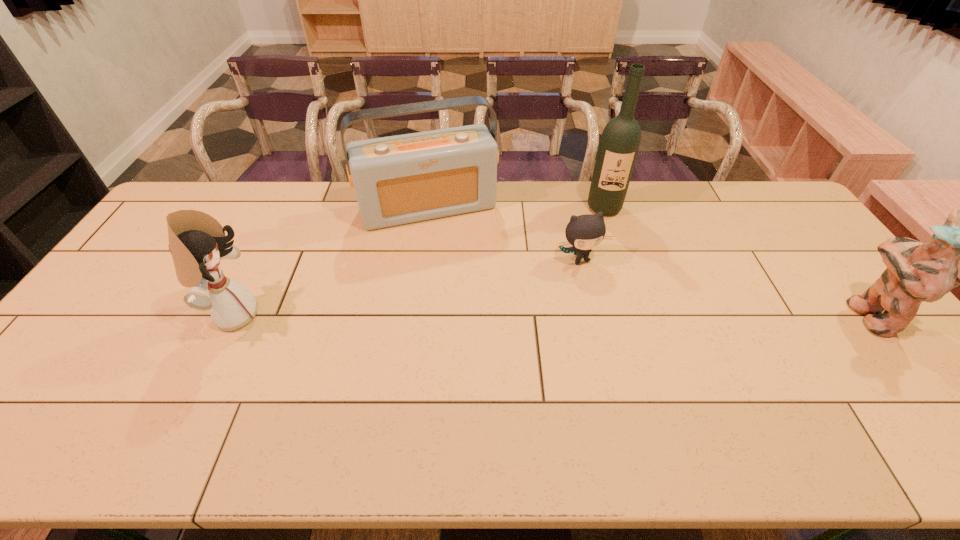
The height and width of the screenshot is (540, 960). What are the coordinates of `free space located on the front-facing side of the radio receiver` in the screenshot? It's located at (473, 305).

Identify the location of free space located on the front-facing side of the radio receiver. Image resolution: width=960 pixels, height=540 pixels. (453, 251).

This screenshot has height=540, width=960. What are the coordinates of `blank space located 0.050m on the front-facing side of the radio receiver` in the screenshot? It's located at (449, 241).

Identify the location of free space located on the labeled side of the tallest object. (608, 245).

Find the location of a particular element. vacant space located 0.300m on the labeled side of the tallest object is located at coordinates (612, 281).

Where is `free space located on the labeled side of the tallest object`? free space located on the labeled side of the tallest object is located at coordinates (610, 262).

Identify the location of vacant space situated 0.320m on the front-facing side of the third nearest object. The height and width of the screenshot is (540, 960). (635, 357).

Locate an element on the screen. The height and width of the screenshot is (540, 960). vacant area situated on the front-facing side of the third nearest object is located at coordinates (618, 327).

At what (x,y) coordinates should I click in order to perform the action: click on vacant space located on the front-facing side of the third nearest object. Please return your answer as a coordinate pair (x, y). This screenshot has width=960, height=540. Looking at the image, I should click on (635, 357).

The width and height of the screenshot is (960, 540). I want to click on radio receiver that is positioned at the far edge, so click(x=401, y=179).